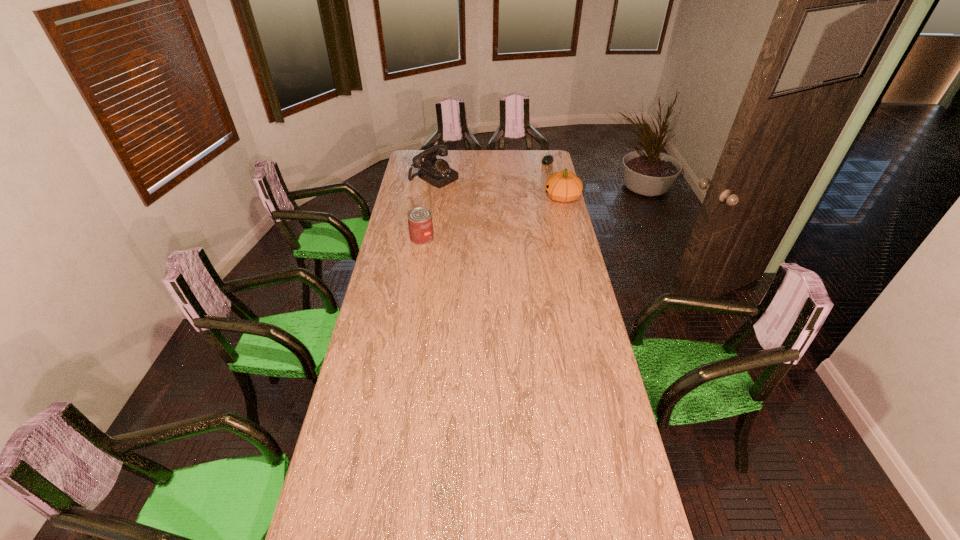
The height and width of the screenshot is (540, 960). I want to click on can, so (x=420, y=223).

This screenshot has width=960, height=540. Find the location of `the second shortest object`. the second shortest object is located at coordinates (420, 223).

At what (x,y) coordinates should I click in order to perform the action: click on gourd. Please return your answer as a coordinate pair (x, y). Looking at the image, I should click on (563, 186).

The height and width of the screenshot is (540, 960). In order to click on the farthest object in this screenshot , I will do `click(547, 159)`.

The width and height of the screenshot is (960, 540). What are the coordinates of `computer mouse` in the screenshot? It's located at (547, 159).

Locate an element on the screen. The image size is (960, 540). telephone is located at coordinates (436, 172).

Locate an element on the screen. vacant space situated 0.130m on the back of the second shortest object is located at coordinates (425, 217).

Find the location of a particular element. The width and height of the screenshot is (960, 540). vacant position located on the side of the gourd with the carved face is located at coordinates (483, 197).

Where is `vacant space located on the side of the gourd with the carved face`? Image resolution: width=960 pixels, height=540 pixels. vacant space located on the side of the gourd with the carved face is located at coordinates (488, 197).

This screenshot has width=960, height=540. I want to click on vacant space situated 0.130m on the side of the gourd with the carved face, so click(519, 197).